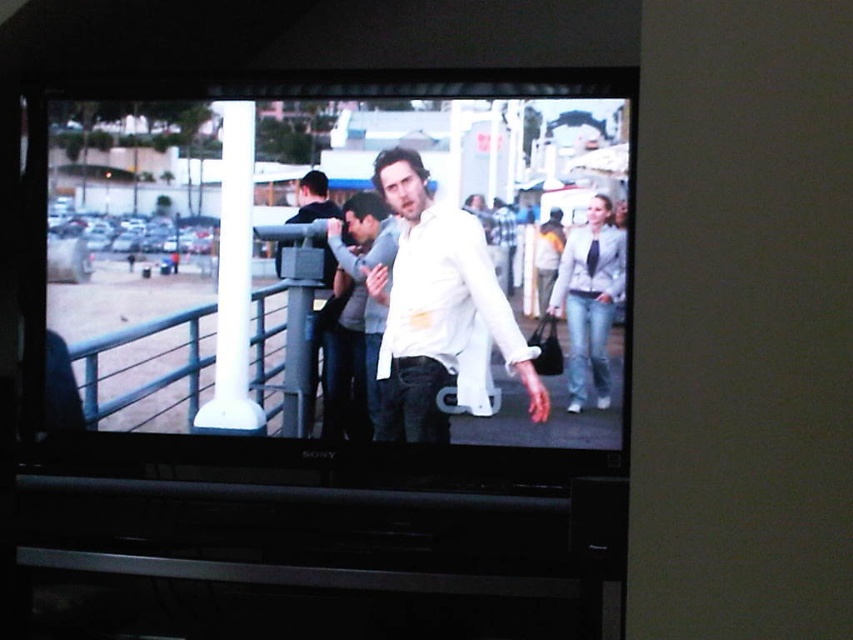
Does white metal/rail at left have a greater width compared to light gray textured jacket at right?

Correct, the width of white metal/rail at left exceeds that of light gray textured jacket at right.

Which is in front, point (144, 394) or point (584, 323)?

Point (584, 323)

At what (x,y) coordinates should I click in order to perform the action: click on white metal/rail at left. Please return your answer as a coordinate pair (x, y). This screenshot has height=640, width=853. Looking at the image, I should click on click(148, 371).

Does white glossy shirt at center have a greater height compared to smooth gray pole at center?

Indeed, white glossy shirt at center has a greater height compared to smooth gray pole at center.

Measure the distance between white glossy shirt at center and smooth gray pole at center.

white glossy shirt at center is 7.70 inches away from smooth gray pole at center.

Does point (469, 292) lie in front of point (320, 246)?

Yes, point (469, 292) is in front of point (320, 246).

Where is `white glossy shirt at center`? white glossy shirt at center is located at coordinates (341, 262).

Who is taller, white plastic pole at center or light gray textured jacket at right?

With more height is white plastic pole at center.

Can you confirm if white plastic pole at center is wider than light gray textured jacket at right?

Correct, the width of white plastic pole at center exceeds that of light gray textured jacket at right.

Does point (233, 204) lie in front of point (579, 243)?

No, (233, 204) is further to viewer.

At what (x,y) coordinates should I click in order to perform the action: click on white plastic pole at center. Please return your answer as a coordinate pair (x, y). Looking at the image, I should click on (x=233, y=282).